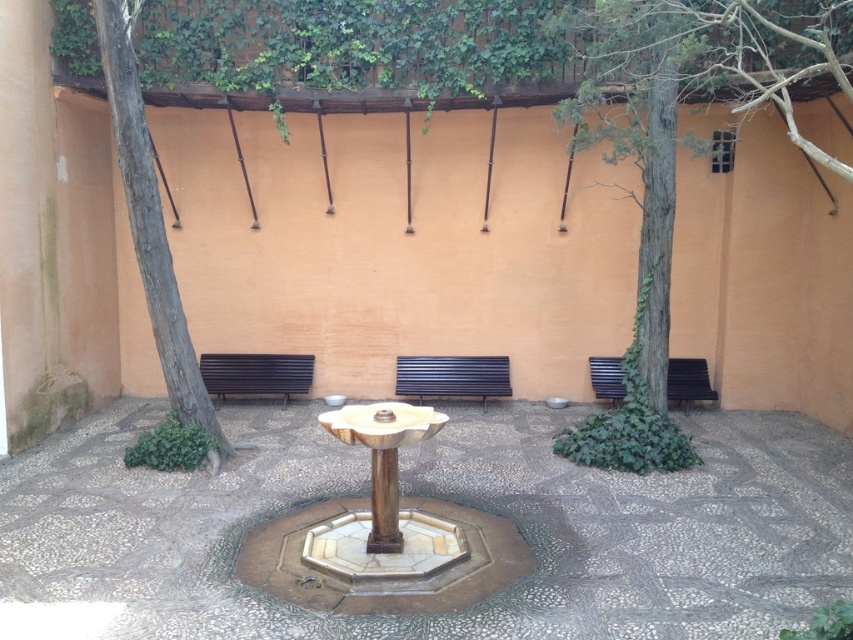
Can you confirm if green leafy tree at left is shorter than brown wooden bench at center?

Incorrect, green leafy tree at left's height does not fall short of brown wooden bench at center's.

Is green leafy tree at left bigger than brown wooden bench at center?

Correct, green leafy tree at left is larger in size than brown wooden bench at center.

You are a GUI agent. You are given a task and a screenshot of the screen. Output one action in this format:
    pyautogui.click(x=<x>, y=<y>)
    Task: Click on the green leafy tree at left
    This screenshot has height=640, width=853.
    Given the screenshot: What is the action you would take?
    pyautogui.click(x=151, y=227)

Identify the location of green leafy tree at left. (151, 227).

Can you confirm if brown wooden bench at center is smaller than black wood bench at left?

Actually, brown wooden bench at center might be larger than black wood bench at left.

Who is shorter, brown wooden bench at center or black wood bench at left?

brown wooden bench at center is shorter.

Image resolution: width=853 pixels, height=640 pixels. Describe the element at coordinates (451, 376) in the screenshot. I see `brown wooden bench at center` at that location.

Locate an element on the screen. This screenshot has width=853, height=640. brown wooden bench at center is located at coordinates (451, 376).

Is the position of brown wooden bench at center less distant than that of wooden park bench at right?

That is False.

Does brown wooden bench at center appear on the right side of wooden park bench at right?

No, brown wooden bench at center is not to the right of wooden park bench at right.

Is point (415, 387) positioned before point (616, 392)?

No, (415, 387) is behind (616, 392).

Locate an element on the screen. The width and height of the screenshot is (853, 640). brown wooden bench at center is located at coordinates (451, 376).